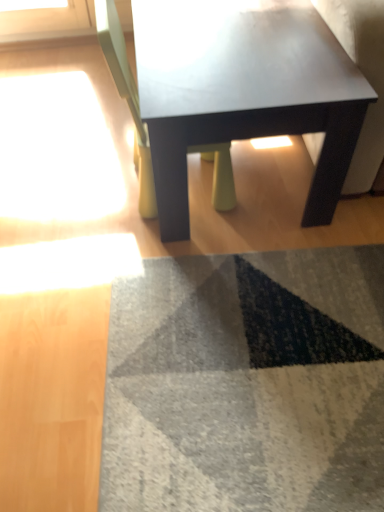
Question: Is matte white chair at center inside the boundaries of matte black coffee table at center, or outside?

Choices:
 (A) outside
 (B) inside

Answer: (B)

Question: Considering the positions of matte white chair at center and matte black coffee table at center in the image, is matte white chair at center bigger or smaller than matte black coffee table at center?

Choices:
 (A) small
 (B) big

Answer: (A)

Question: Is matte white chair at center taller or shorter than matte black coffee table at center?

Choices:
 (A) short
 (B) tall

Answer: (B)

Question: Considering the positions of matte black coffee table at center and matte white chair at center in the image, is matte black coffee table at center wider or thinner than matte white chair at center?

Choices:
 (A) wide
 (B) thin

Answer: (A)

Question: Considering the positions of matte black coffee table at center and matte white chair at center in the image, is matte black coffee table at center bigger or smaller than matte white chair at center?

Choices:
 (A) small
 (B) big

Answer: (B)

Question: From a real-world perspective, is matte black coffee table at center above or below matte white chair at center?

Choices:
 (A) above
 (B) below

Answer: (B)

Question: Is point (225, 23) positioned closer to the camera than point (215, 170)?

Choices:
 (A) farther
 (B) closer

Answer: (B)